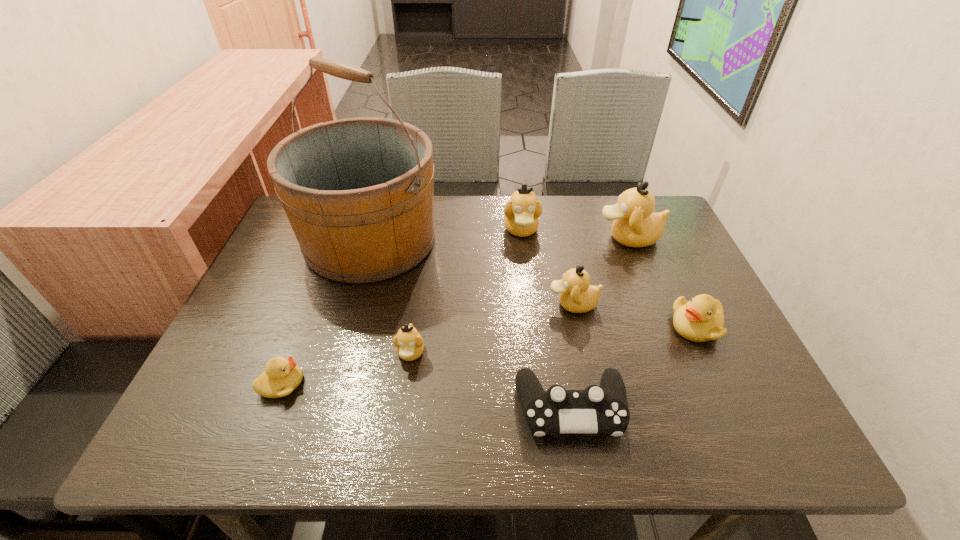
Locate an element on the screen. duckling present at the left edge is located at coordinates (282, 376).

At what (x,y) coordinates should I click in order to perform the action: click on object located at the far left corner. Please return your answer as a coordinate pair (x, y). Looking at the image, I should click on (358, 192).

The width and height of the screenshot is (960, 540). I want to click on object that is at the far right corner, so click(x=635, y=224).

Where is `free region at the far edge of the desktop`? The image size is (960, 540). free region at the far edge of the desktop is located at coordinates (502, 220).

This screenshot has height=540, width=960. Identify the location of free space at the near edge of the desktop. (521, 447).

In the image, there is a desktop. At what (x,y) coordinates should I click in order to perform the action: click on vacant area at the right edge. Please return your answer as a coordinate pair (x, y). This screenshot has width=960, height=540. Looking at the image, I should click on (717, 363).

Image resolution: width=960 pixels, height=540 pixels. In the image, there is a desktop. Identify the location of vacant space at the near right corner. (732, 426).

At what (x,y) coordinates should I click in order to perform the action: click on free space between the leftmost duckling and the seventh shortest object. Please return your answer as a coordinate pair (x, y). This screenshot has height=540, width=960. Looking at the image, I should click on coord(455,311).

Locate an element on the screen. vacant area between the third tallest object and the farther yellow duckling is located at coordinates (609, 278).

This screenshot has width=960, height=540. In order to click on vacant area that lies between the fourth shortest duckling and the black control in this screenshot , I will do `click(572, 356)`.